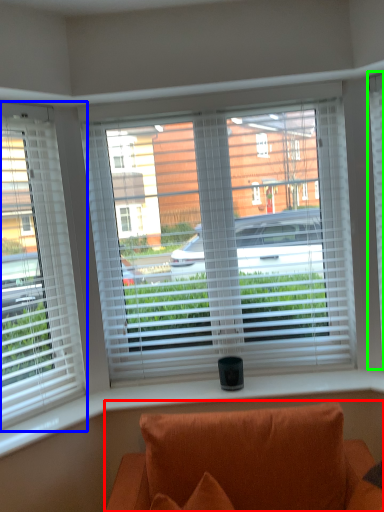
Question: Estimate the real-world distances between objects in this image. Which object is farther from studio couch (highlighted by a red box), window (highlighted by a blue box) or window blind (highlighted by a green box)?

Choices:
 (A) window
 (B) window blind

Answer: (B)